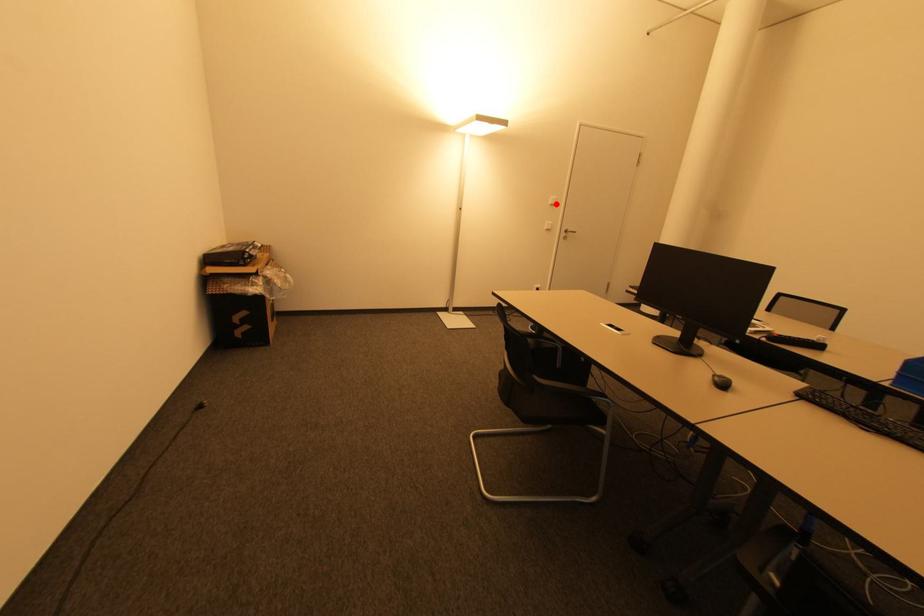
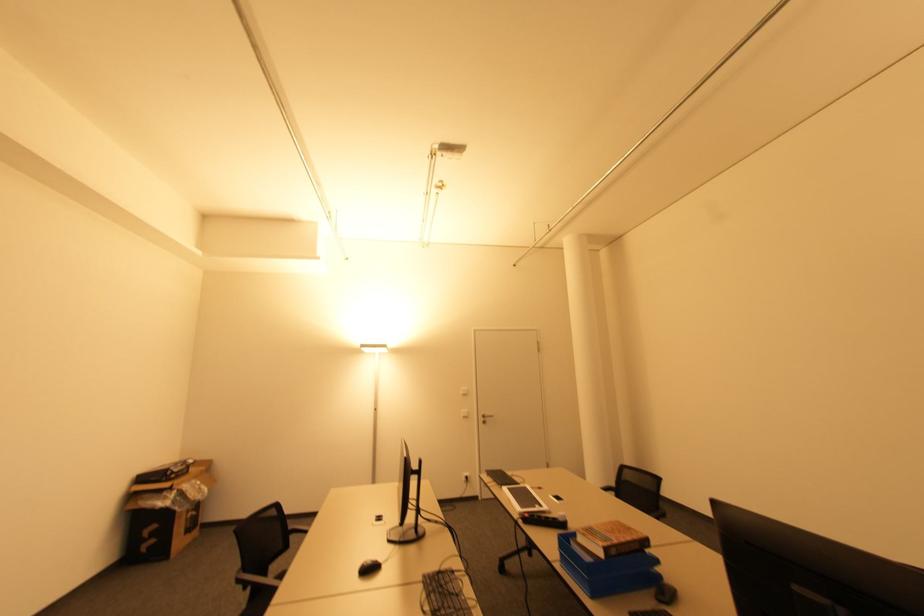
Question: A red point is marked in image1. In image2, is the corresponding 3D point closer to the camera or farther? Reply with the corresponding letter.

Choices:
 (A) The corresponding 3D point is closer.
 (B) The corresponding 3D point is farther.

Answer: (B)